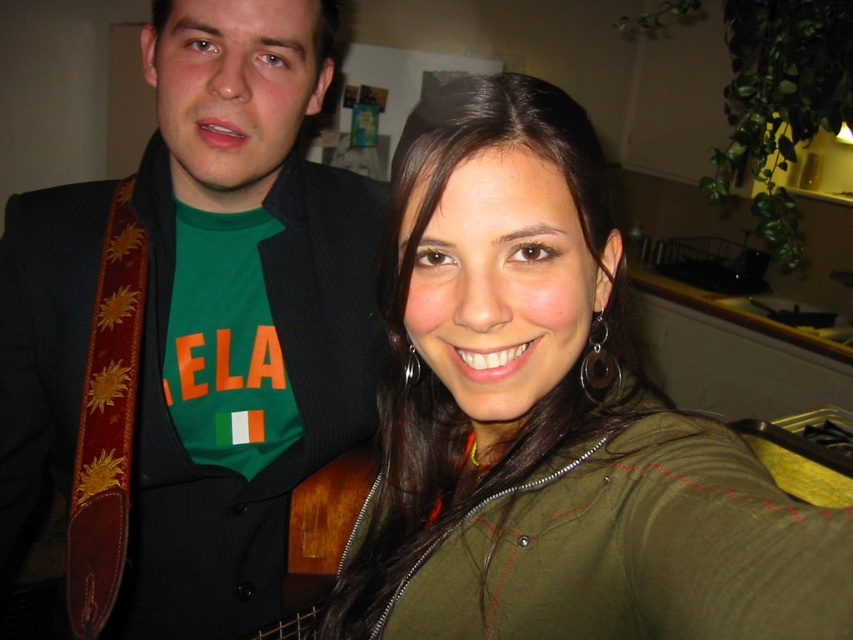
Question: Is green fabric shirt at upper left closer to camera compared to green fabric jacket at center?

Choices:
 (A) no
 (B) yes

Answer: (A)

Question: Does green fabric shirt at upper left have a smaller size compared to green fabric jacket at center?

Choices:
 (A) no
 (B) yes

Answer: (A)

Question: Which of the following is the closest to the observer?

Choices:
 (A) (236, 346)
 (B) (289, 618)
 (C) (607, 397)

Answer: (C)

Question: Does green fabric shirt at upper left appear on the right side of green fabric jacket at center?

Choices:
 (A) no
 (B) yes

Answer: (A)

Question: Which is farther from the green fabric jacket at center?

Choices:
 (A) brown wooden guitar at center
 (B) green fabric shirt at upper left

Answer: (A)

Question: Based on their relative distances, which object is nearer to the brown wooden guitar at center?

Choices:
 (A) green fabric jacket at center
 (B) green fabric shirt at upper left

Answer: (B)